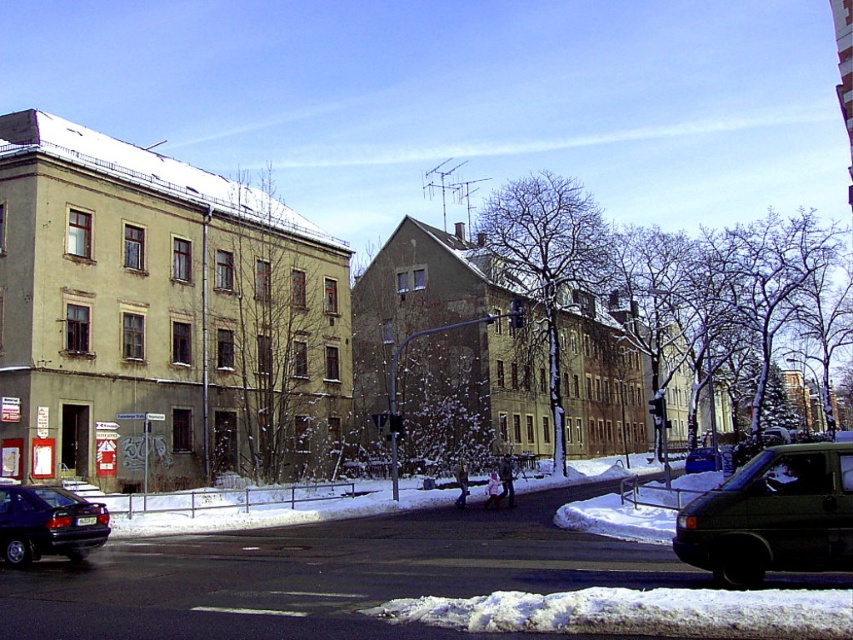
Question: Which point is farther to the camera?

Choices:
 (A) dark green matte car at center
 (B) white fluffy snow at lower center

Answer: (A)

Question: Is shiny dark blue sedan at lower left further to camera compared to dark green matte car at center?

Choices:
 (A) no
 (B) yes

Answer: (A)

Question: Does white fluffy snow at lower center appear on the right side of dark green matte car at center?

Choices:
 (A) yes
 (B) no

Answer: (B)

Question: Can you confirm if white fluffy snow at lower center is smaller than dark green matte van at lower right?

Choices:
 (A) no
 (B) yes

Answer: (B)

Question: Estimate the real-world distances between objects in this image. Which object is closer to the dark green matte van at lower right?

Choices:
 (A) shiny dark blue sedan at lower left
 (B) white fluffy snow at lower center
 (C) dark green matte car at center

Answer: (B)

Question: Estimate the real-world distances between objects in this image. Which object is farther from the white fluffy snow at lower center?

Choices:
 (A) dark green matte van at lower right
 (B) dark green matte car at center
 (C) shiny dark blue sedan at lower left

Answer: (B)